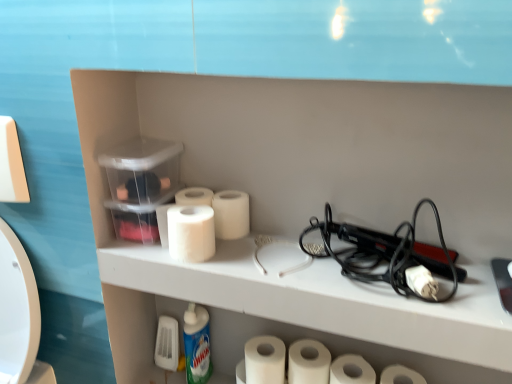
Question: Which direction should I rotate to look at white matte toilet paper at center, which ranks as the sixth toilet paper in right-to-left order?

Choices:
 (A) left
 (B) right

Answer: (A)

Question: Is white matte paper towel at center further to camera compared to white matte toilet paper at lower center, which ranks as the 4th toilet paper in left-to-right order?

Choices:
 (A) no
 (B) yes

Answer: (B)

Question: From the image's perspective, is white matte paper towel at center above white matte toilet paper at lower center, which is the 3th toilet paper from right to left?

Choices:
 (A) yes
 (B) no

Answer: (A)

Question: From the image's perspective, is white matte paper towel at center under white matte toilet paper at lower center, which is the 3th toilet paper from right to left?

Choices:
 (A) no
 (B) yes

Answer: (A)

Question: Would you say white matte paper towel at center is outside white matte toilet paper at lower center, which ranks as the 4th toilet paper in left-to-right order?

Choices:
 (A) no
 (B) yes

Answer: (B)

Question: Can you confirm if white matte paper towel at center is positioned to the left of white matte toilet paper at lower center, which is the 3th toilet paper from right to left?

Choices:
 (A) no
 (B) yes

Answer: (B)

Question: Can you confirm if white matte paper towel at center is smaller than white matte toilet paper at lower center, which is the 3th toilet paper from right to left?

Choices:
 (A) no
 (B) yes

Answer: (B)

Question: Can you confirm if black plastic hair straightener at right is positioned to the left of white matte toilet paper at center, placed as the 2th toilet paper when sorted from right to left?

Choices:
 (A) yes
 (B) no

Answer: (A)

Question: Is black plastic hair straightener at right to the right of white matte toilet paper at center, placed as the 2th toilet paper when sorted from right to left, from the viewer's perspective?

Choices:
 (A) no
 (B) yes

Answer: (A)

Question: Considering the relative sizes of black plastic hair straightener at right and white matte toilet paper at center, placed as the 2th toilet paper when sorted from right to left, in the image provided, is black plastic hair straightener at right wider than white matte toilet paper at center, placed as the 2th toilet paper when sorted from right to left,?

Choices:
 (A) yes
 (B) no

Answer: (A)

Question: From a real-world perspective, is black plastic hair straightener at right physically below white matte toilet paper at center, placed as the 2th toilet paper when sorted from right to left?

Choices:
 (A) no
 (B) yes

Answer: (A)

Question: Can you confirm if black plastic hair straightener at right is thinner than white matte toilet paper at center, marked as the 5th toilet paper in a left-to-right arrangement?

Choices:
 (A) no
 (B) yes

Answer: (A)

Question: Is black plastic hair straightener at right closer to the viewer compared to white matte toilet paper at center, placed as the 2th toilet paper when sorted from right to left?

Choices:
 (A) yes
 (B) no

Answer: (A)

Question: Is white glossy bottle at lower center facing away from black plastic hair straightener at right?

Choices:
 (A) no
 (B) yes

Answer: (A)